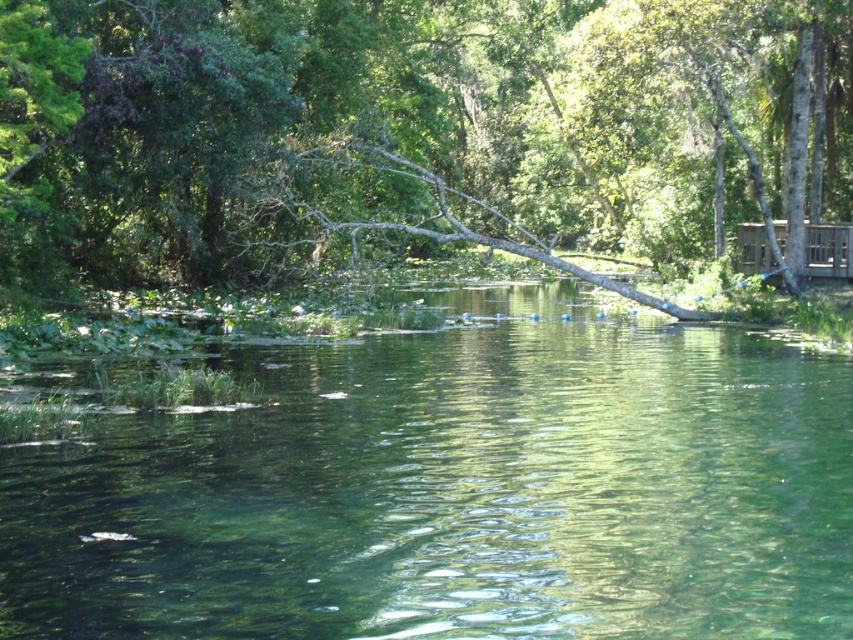
You are standing at the edge of the water and want to see the top of the wooden cabin at right. Can you see it behind the green leafy tree at center?

The green leafy tree at center is taller than the wooden cabin at right, so the top of the wooden cabin at right might be partially or fully obscured by the tree.

You are standing on the bank of the lake and see the clear water at center and the green leafy tree at center. Which object is positioned to the left?

The clear water at center is to the left of the green leafy tree at center.

You are planning to place a 2 meter wide decorative stone in the scene. Given the clear water at center and the green leafy tree at center, which one can accommodate the stone without exceeding its width?

The green leafy tree at center can accommodate the stone since its width is greater than the clear water at center, which is narrower and may not fit the 2 meter wide stone.